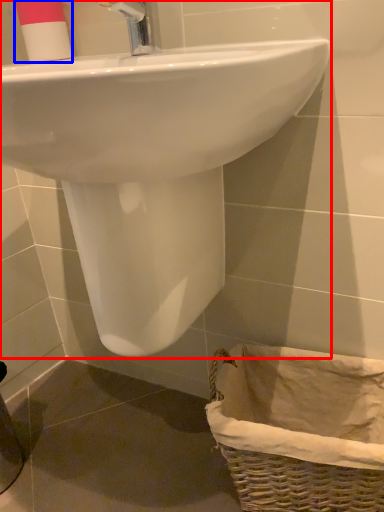
Question: Among these objects, which one is nearest to the camera, sink (highlighted by a red box) or toiletry (highlighted by a blue box)?

Choices:
 (A) sink
 (B) toiletry

Answer: (A)